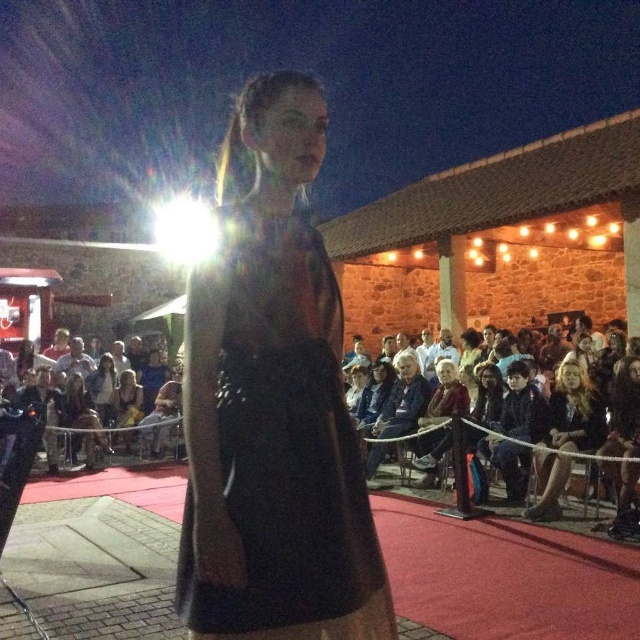
Based on the photo, you are a photographer at the fashion show. You want to take a photo of the model walking down the runway. The model is currently at point A, which is at coordinates point (529, 371), and moving towards point B, which is at coordinates point (412, 356). To ensure the model is in focus, you need to know if point A is closer to the camera than point B. Can you determine this based on the scene?

Point (529, 371) is in front of point (412, 356), so yes, point A is closer to the camera than point B.